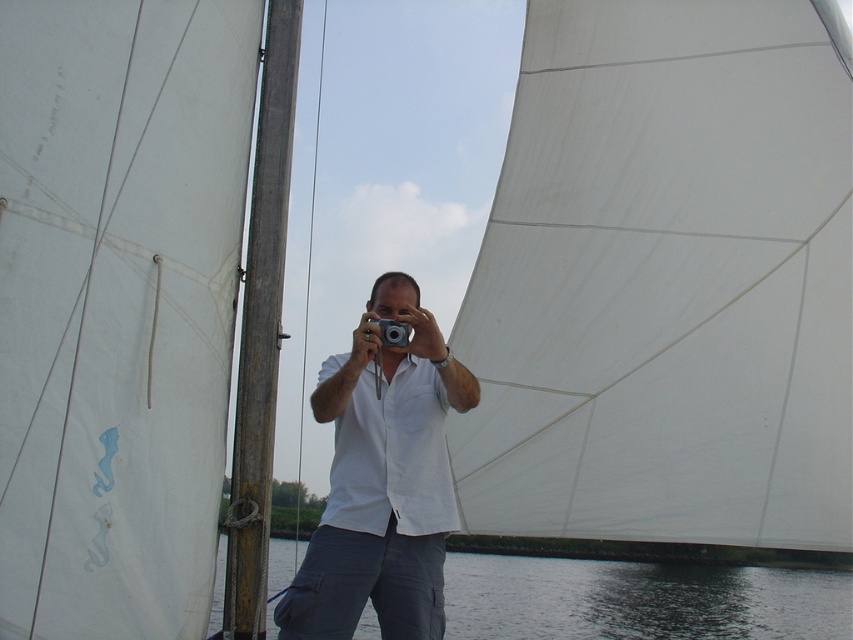
You are a photographer trying to capture the perfect shot. You notice the white cotton shirt at center and the silver metallic camera at center. Which object is positioned higher in the image?

The silver metallic camera at center is positioned higher than the white cotton shirt at center.

Looking at this image, you are a photographer on a sailboat and want to capture the dark blue water at lower center and the silver metallic camera at center in your photo. Which object should you focus on first if you want to ensure both are in frame?

The dark blue water at lower center is bigger than the silver metallic camera at center, so you should focus on the larger dark blue water at lower center first to ensure it fits properly in the frame before adjusting for the smaller silver metallic camera at center.

You are a photographer trying to capture the reflection of the sailboat in the water. The dark blue water at lower center and the silver metallic camera at center are in your viewfinder. Which object is positioned lower in the frame?

The dark blue water at lower center is positioned below the silver metallic camera at center, so it is lower in the frame.